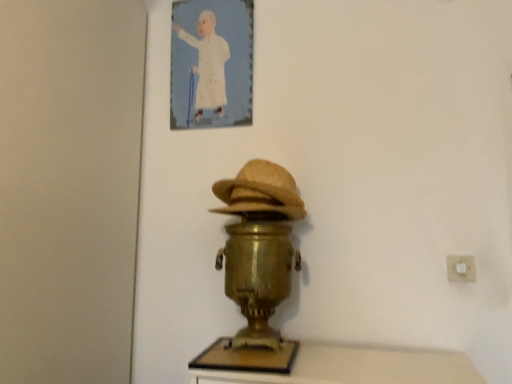
Question: In the image, is gold metallic samovar at center on the left side or the right side of white plastic electric outlet at lower right?

Choices:
 (A) left
 (B) right

Answer: (A)

Question: Based on their sizes in the image, would you say gold metallic samovar at center is bigger or smaller than white plastic electric outlet at lower right?

Choices:
 (A) big
 (B) small

Answer: (A)

Question: Which of these objects is positioned farthest from the bleached straw hat at center?

Choices:
 (A) gold metallic samovar at center
 (B) white plastic electric outlet at lower right
 (C) white paper at upper center

Answer: (B)

Question: Estimate the real-world distances between objects in this image. Which object is farther from the bleached straw hat at center?

Choices:
 (A) white paper at upper center
 (B) gold metallic samovar at center
 (C) white plastic electric outlet at lower right

Answer: (C)